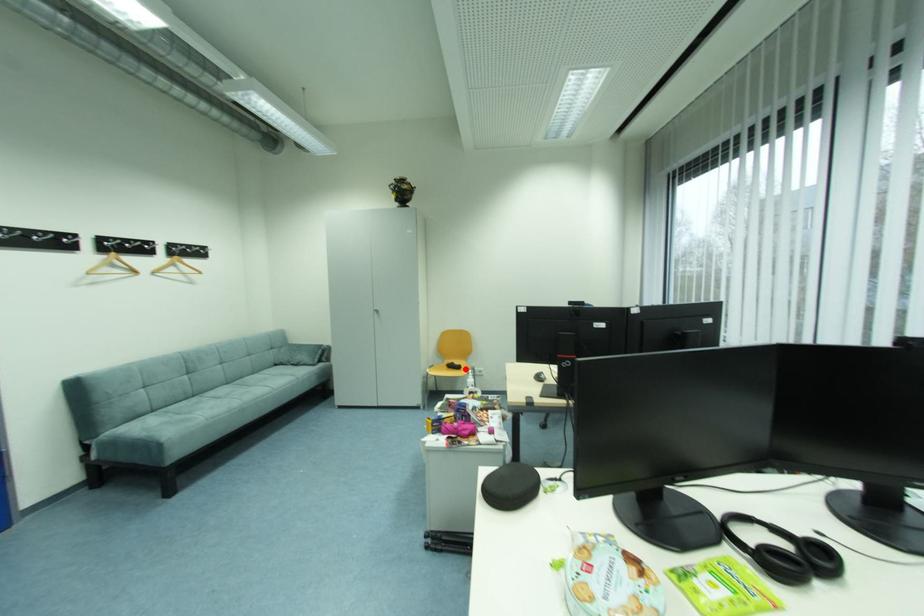
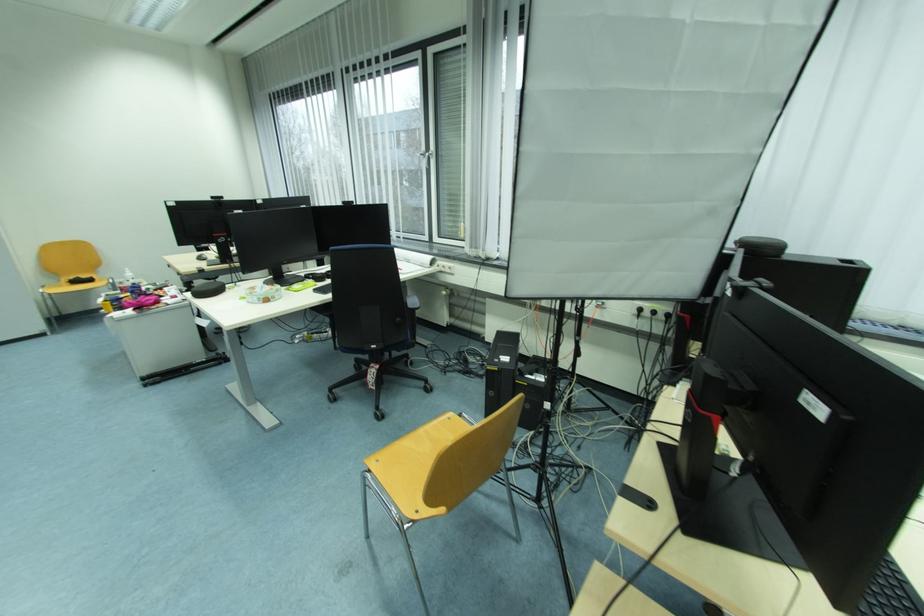
Where in the second image is the point corresponding to the highlighted location from the first image?

(96, 282)